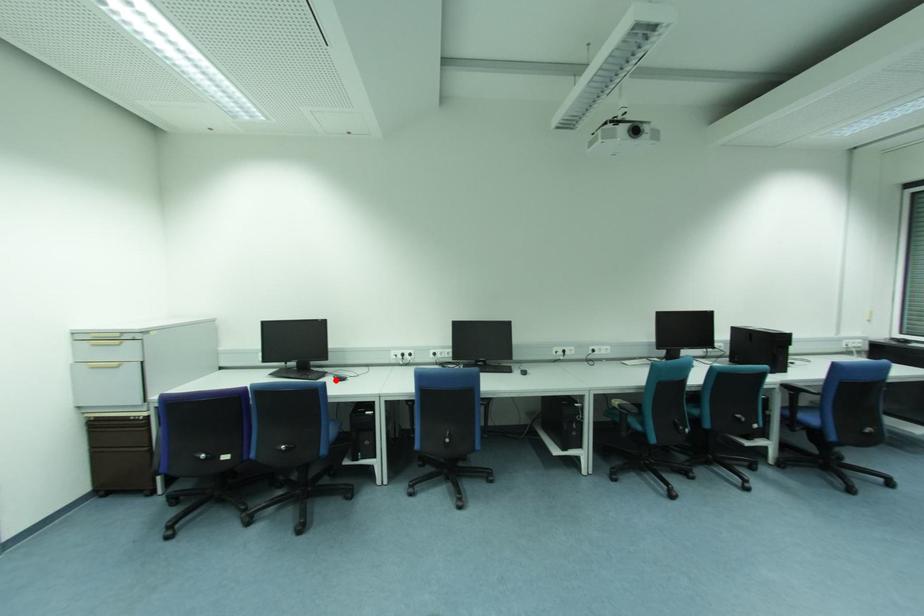
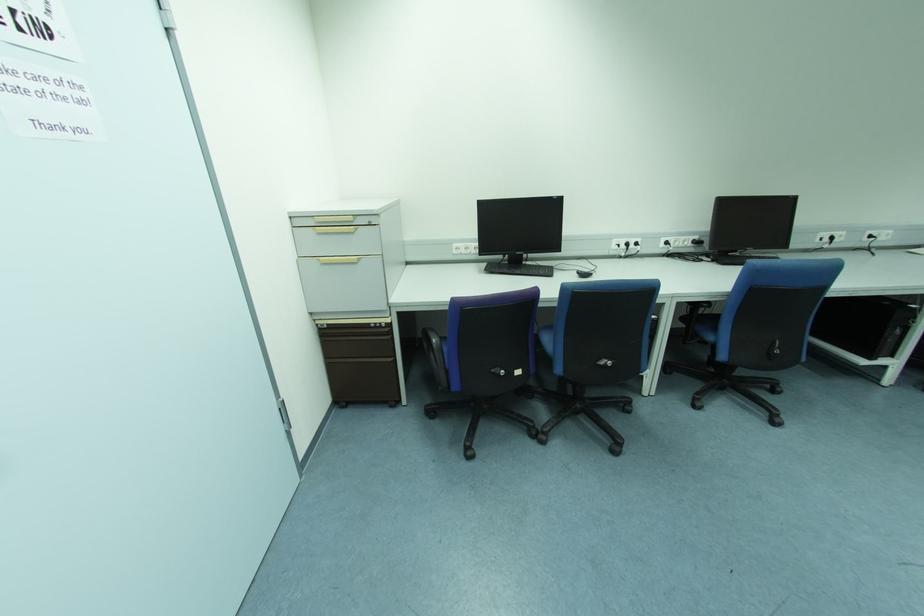
The point at the highlighted location is marked in the first image. Where is the corresponding point in the second image?

(578, 276)